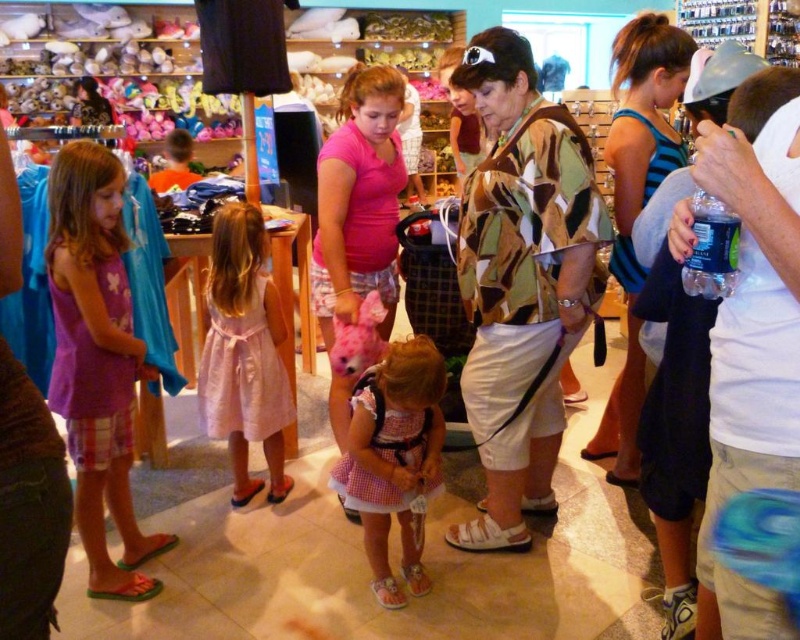
What do you see at coordinates (637, 204) in the screenshot? This screenshot has width=800, height=640. I see `blue striped tank top at right` at bounding box center [637, 204].

Is blue striped tank top at right to the right of pink gingham dress at center from the viewer's perspective?

Indeed, blue striped tank top at right is positioned on the right side of pink gingham dress at center.

Who is more distant from viewer, (610, 125) or (388, 468)?

Point (610, 125)

Locate an element on the screen. Image resolution: width=800 pixels, height=640 pixels. blue striped tank top at right is located at coordinates (637, 204).

Which is more to the right, pink matte shirt at center or pink satin dress at center?

pink matte shirt at center

Where is `pink matte shirt at center`? The width and height of the screenshot is (800, 640). pink matte shirt at center is located at coordinates (360, 200).

The width and height of the screenshot is (800, 640). Describe the element at coordinates (360, 200) in the screenshot. I see `pink matte shirt at center` at that location.

Find the location of a particular element. pink matte shirt at center is located at coordinates (360, 200).

Does pink satin dress at center appear over pink gingham dress at center?

Yes.

Does point (284, 376) lie in front of point (438, 408)?

No, (284, 376) is behind (438, 408).

At what (x,y) coordinates should I click in order to perform the action: click on pink satin dress at center. Please return your answer as a coordinate pair (x, y). Image resolution: width=800 pixels, height=640 pixels. Looking at the image, I should click on (244, 353).